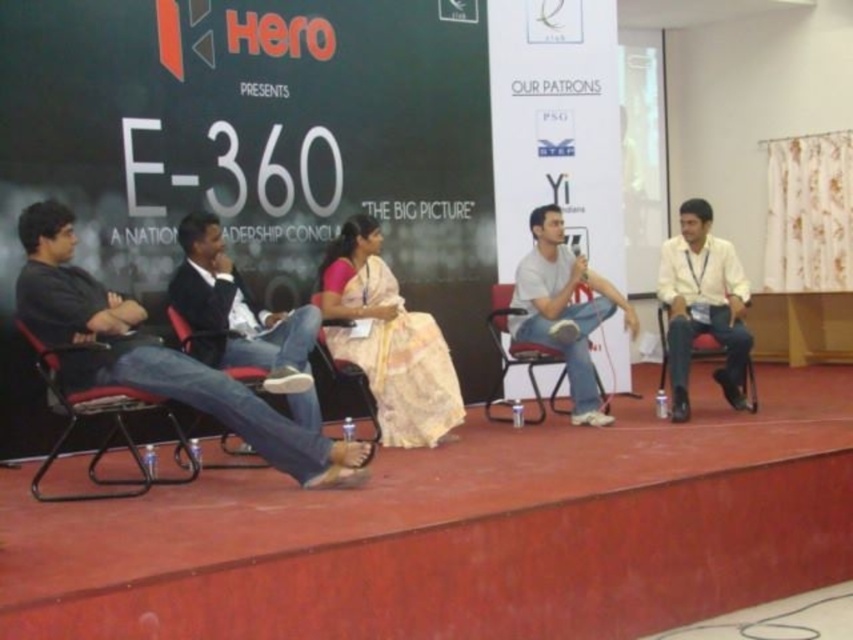
Question: Is black cotton shirt at left smaller than silk saree at center?

Choices:
 (A) no
 (B) yes

Answer: (A)

Question: Among these points, which one is farthest from the camera?

Choices:
 (A) (132, 492)
 (B) (604, 410)
 (C) (354, 371)

Answer: (B)

Question: Among these points, which one is farthest from the camera?

Choices:
 (A) (234, 467)
 (B) (532, 348)
 (C) (355, 372)
 (D) (376, 305)

Answer: (B)

Question: Which point is farther to the camera?

Choices:
 (A) coord(491,323)
 (B) coord(567,269)
 (C) coord(190,337)
 (D) coord(370,401)

Answer: (D)

Question: Is black cotton shirt at left below metallic silver chair at center?

Choices:
 (A) no
 (B) yes

Answer: (A)

Question: Does silk saree at center have a smaller size compared to metallic silver chair at right?

Choices:
 (A) yes
 (B) no

Answer: (B)